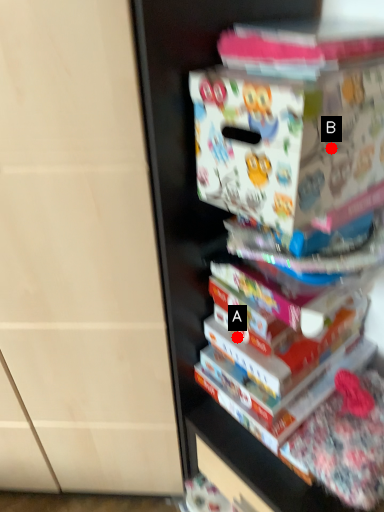
Question: Two points are circled on the image, labeled by A and B beside each circle. Which point appears farthest from the camera in this image?

Choices:
 (A) A is further
 (B) B is further

Answer: (A)